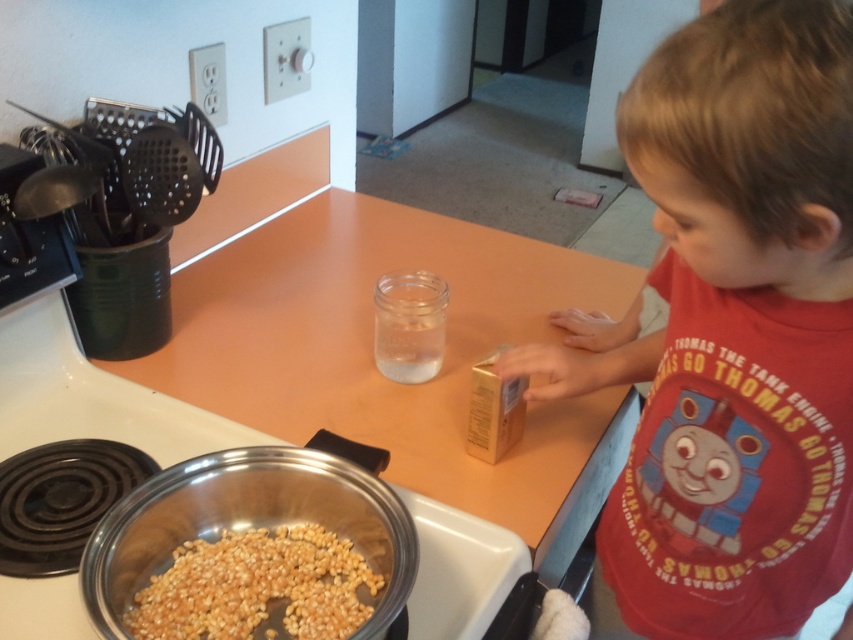
Who is positioned more to the left, thomas the tank engine shirt at center or yellow matte popcorn at lower left?

yellow matte popcorn at lower left is more to the left.

Is thomas the tank engine shirt at center further to camera compared to yellow matte popcorn at lower left?

That is False.

Is point (831, 115) closer to camera compared to point (183, 600)?

Yes.

This screenshot has height=640, width=853. I want to click on thomas the tank engine shirt at center, so click(734, 328).

Does smooth orange countertop at center have a lesser width compared to stainless steel pot at lower left?

No, smooth orange countertop at center is not thinner than stainless steel pot at lower left.

Is point (392, 232) more distant than point (485, 611)?

Yes.

Identify the location of smooth orange countertop at center. The image size is (853, 640). (372, 355).

Who is higher up, thomas the tank engine shirt at center or metallic silver bowl at lower left?

Positioned higher is thomas the tank engine shirt at center.

What do you see at coordinates (734, 328) in the screenshot? I see `thomas the tank engine shirt at center` at bounding box center [734, 328].

Does point (514, 372) come behind point (379, 625)?

Yes, point (514, 372) is farther from viewer.

Where is `thomas the tank engine shirt at center`? The height and width of the screenshot is (640, 853). thomas the tank engine shirt at center is located at coordinates (734, 328).